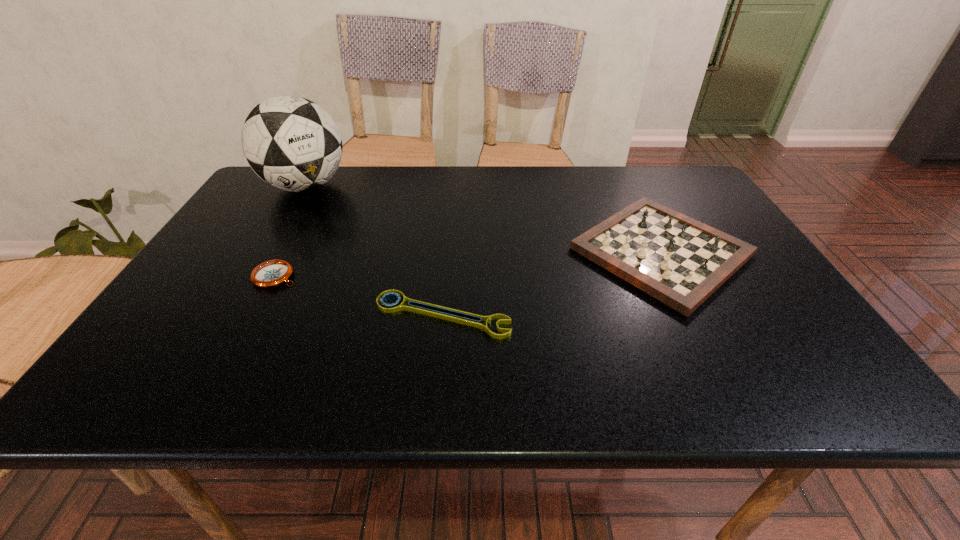
Identify the location of vacant point at the far left corner. (269, 186).

In the image, there is a desktop. Identify the location of free space at the far right corner. (672, 197).

Where is `vacant region at the near right corner of the desktop`? This screenshot has height=540, width=960. vacant region at the near right corner of the desktop is located at coordinates (790, 380).

At what (x,y) coordinates should I click in order to perform the action: click on free point between the chessboard and the soccer ball. Please return your answer as a coordinate pair (x, y). Looking at the image, I should click on (483, 219).

In order to click on empty location between the soccer ball and the shortest object in this screenshot , I will do `click(374, 251)`.

Locate an element on the screen. empty location between the shortest object and the compass is located at coordinates tap(359, 296).

The height and width of the screenshot is (540, 960). Find the location of `empty location between the compass and the shortest object`. empty location between the compass and the shortest object is located at coordinates (359, 296).

Locate an element on the screen. This screenshot has height=540, width=960. empty space that is in between the shortest object and the second shortest object is located at coordinates (359, 296).

I want to click on free space between the shortest object and the soccer ball, so click(374, 251).

Locate an element on the screen. The height and width of the screenshot is (540, 960). vacant space in between the chessboard and the soccer ball is located at coordinates (483, 219).